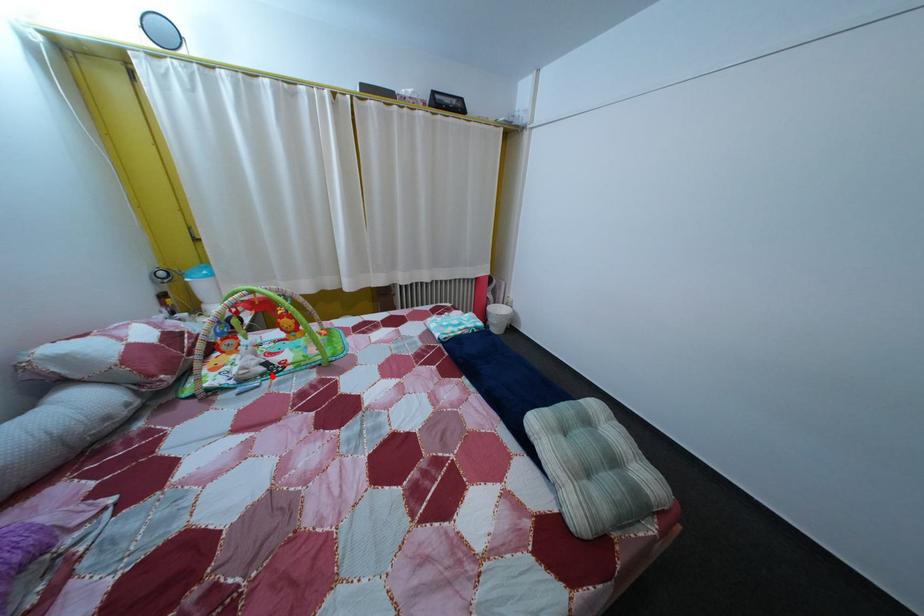
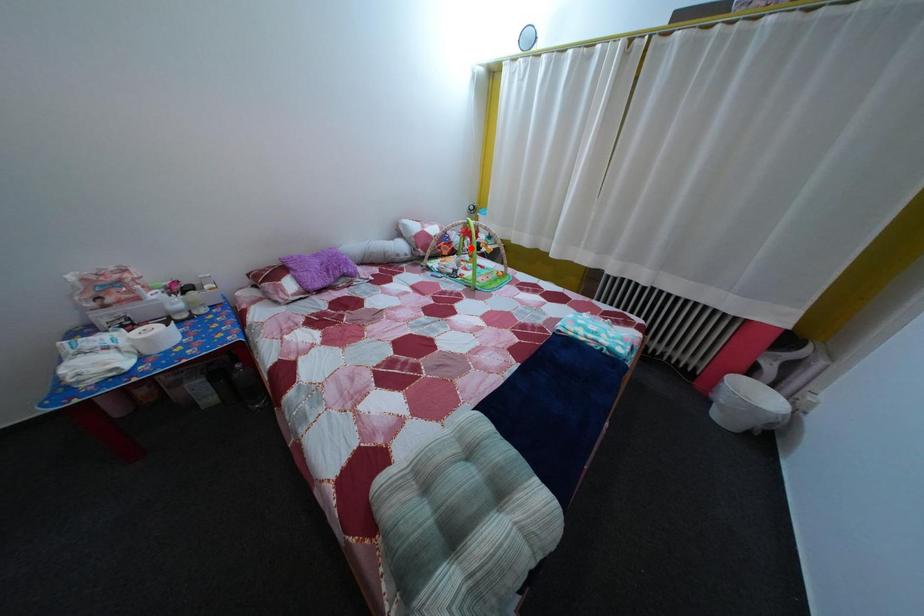
I am providing you with two images of the same scene from different viewpoints. A red point is marked on the first image and another point is marked on the second image. Is the marked point in image1 the same physical position as the marked point in image2?

No